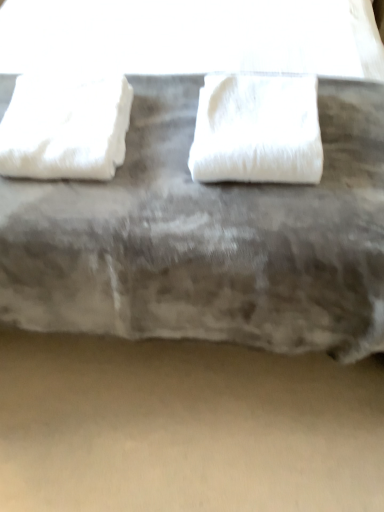
Question: Would you say white fluffy towel at left, the first towel positioned from the left, is to the left or to the right of white fluffy towel at center, the 1th towel from the right, in the picture?

Choices:
 (A) right
 (B) left

Answer: (B)

Question: From the image's perspective, is white fluffy towel at left, which ranks as the 2th towel in right-to-left order, above or below white fluffy towel at center, the 1th towel from the right?

Choices:
 (A) above
 (B) below

Answer: (A)

Question: Which of these objects is positioned farthest from the white fluffy towel at center, acting as the second towel starting from the left?

Choices:
 (A) white fabric at center
 (B) white fluffy towel at left, the first towel positioned from the left
 (C) beige matte concrete at lower center

Answer: (C)

Question: Which object is the closest to the beige matte concrete at lower center?

Choices:
 (A) white fluffy towel at left, which ranks as the 2th towel in right-to-left order
 (B) white fabric at center
 (C) white fluffy towel at center, acting as the second towel starting from the left

Answer: (B)